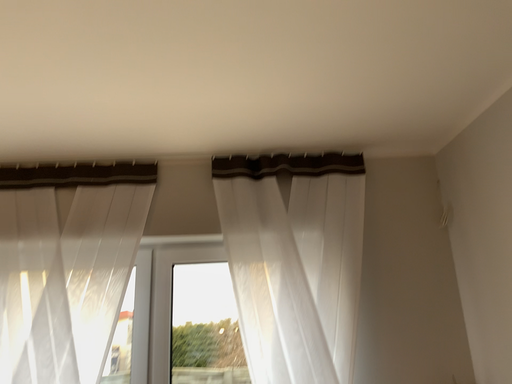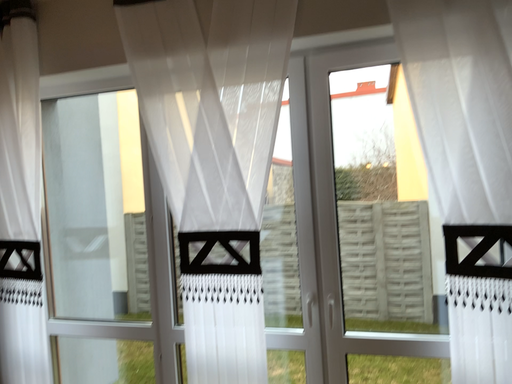
Question: Which way did the camera rotate in the video?

Choices:
 (A) rotated upward
 (B) rotated downward

Answer: (B)